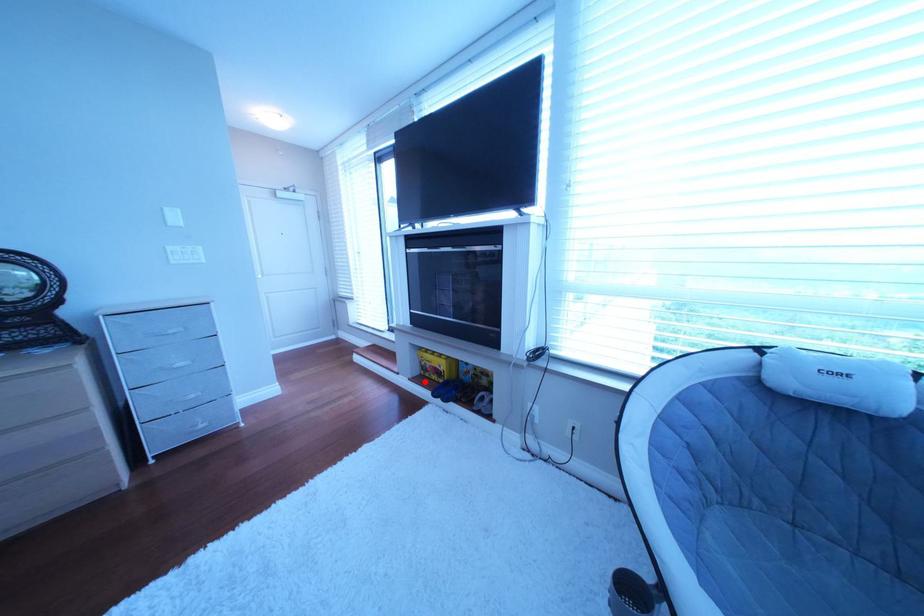
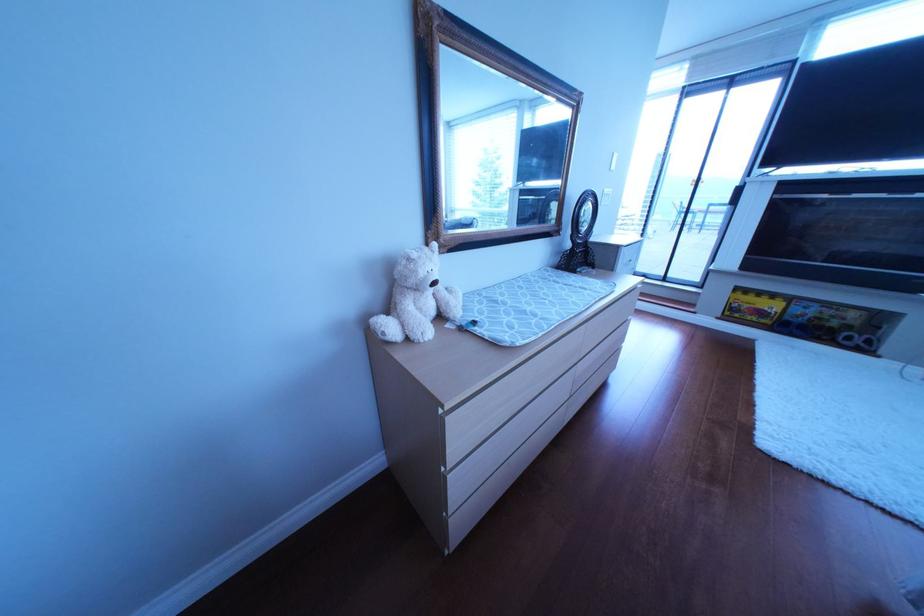
Question: I am providing you with two images of the same scene from different viewpoints. A red point is shown in image1. For the corresponding object point in image2, is it positioned nearer or farther from the camera?

Choices:
 (A) Nearer
 (B) Farther

Answer: (A)